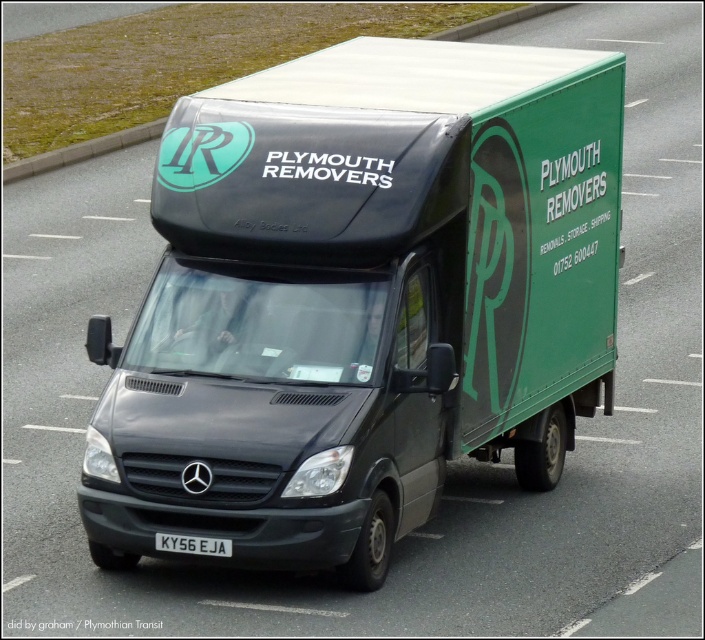
What is the spatial relationship between the matte black van at center and the white plastic license plate at center?

The matte black van at center is located above the white plastic license plate at center.

You are a photographer trying to capture a clear shot of the matte black van at center and the white plastic license plate at center. Since you want to focus on the van, which object should you zoom in on more?

The matte black van at center is bigger than the white plastic license plate at center, so you should zoom in on the matte black van at center to focus on it more clearly.